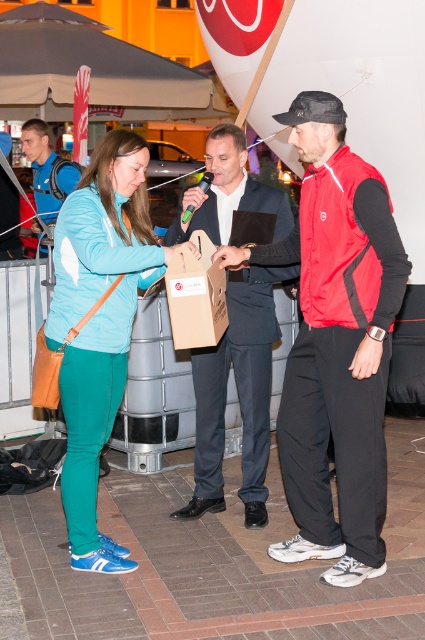
Is red synthetic vest at center closer to camera compared to blue fabric backpack at left?

That is True.

Which is behind, point (297, 136) or point (28, 122)?

The point (28, 122) is behind.

Identify the location of red synthetic vest at center. Image resolution: width=425 pixels, height=640 pixels. (336, 344).

In the scene shown: Does gray fabric canopy at upper center have a larger size compared to brown cardboard box at center?

Correct, gray fabric canopy at upper center is larger in size than brown cardboard box at center.

Does point (6, 51) lie in front of point (187, 346)?

No.

Who is more forward, (x=124, y=49) or (x=167, y=276)?

Point (x=167, y=276)

The image size is (425, 640). In order to click on gray fabric canopy at upper center in this screenshot , I will do `click(90, 70)`.

Can you confirm if teal fabric jacket at left is bigger than gray fabric canopy at upper center?

No, teal fabric jacket at left is not bigger than gray fabric canopy at upper center.

Can you confirm if teal fabric jacket at left is wider than gray fabric canopy at upper center?

No.

Image resolution: width=425 pixels, height=640 pixels. In order to click on teal fabric jacket at left in this screenshot , I will do `click(99, 323)`.